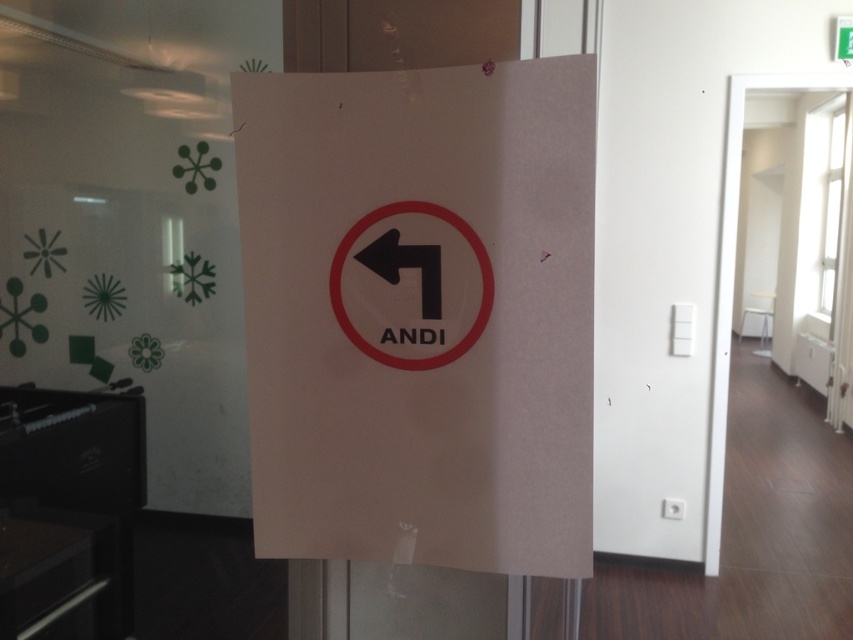
Who is taller, black plastic sign at center or white paper sign at center?

With more height is black plastic sign at center.

Between black plastic sign at center and white paper sign at center, which one appears on the right side from the viewer's perspective?

white paper sign at center is more to the right.

I want to click on black plastic sign at center, so click(x=479, y=272).

Find the location of `black plastic sign at center`. black plastic sign at center is located at coordinates (479, 272).

Which is in front, point (392, 232) or point (838, 28)?

Positioned in front is point (392, 232).

Does black matte arrow at center have a lesser width compared to white paper sign at center?

Incorrect, black matte arrow at center's width is not less than white paper sign at center's.

Who is more forward, (x=425, y=292) or (x=836, y=48)?

Point (x=425, y=292) is more forward.

Locate an element on the screen. black matte arrow at center is located at coordinates (405, 266).

Is black plastic sign at center behind black matte arrow at center?

No, black plastic sign at center is in front of black matte arrow at center.

Measure the distance between black plastic sign at center and camera.

black plastic sign at center and camera are 31.46 inches apart from each other.

Where is `black plastic sign at center`? black plastic sign at center is located at coordinates (479, 272).